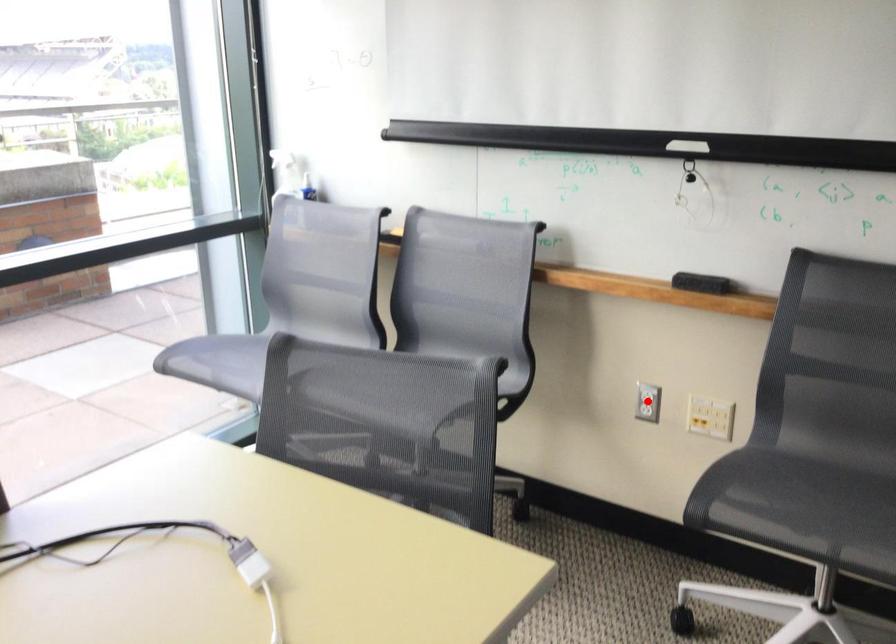
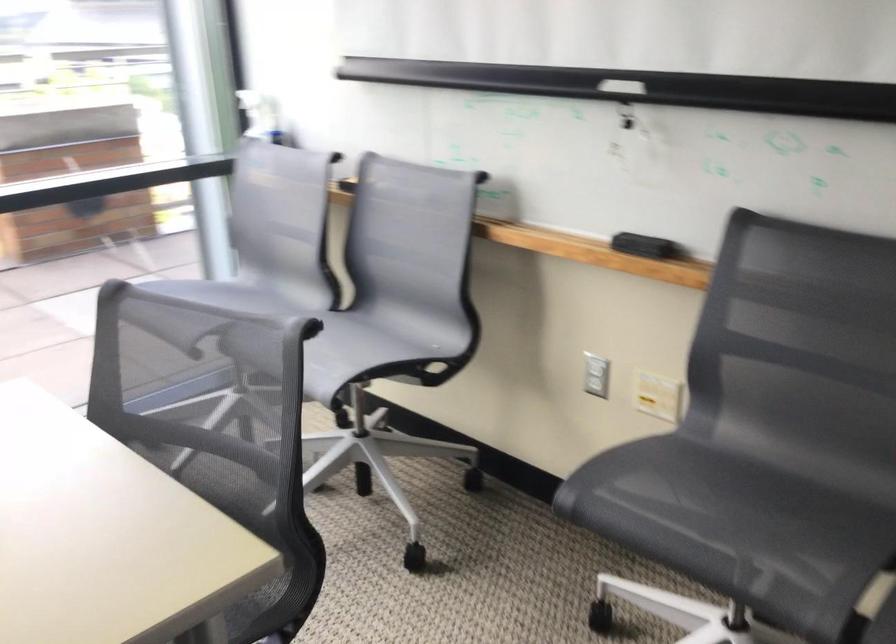
Where in the second image is the point corresponding to the highlighted location from the first image?

(596, 375)